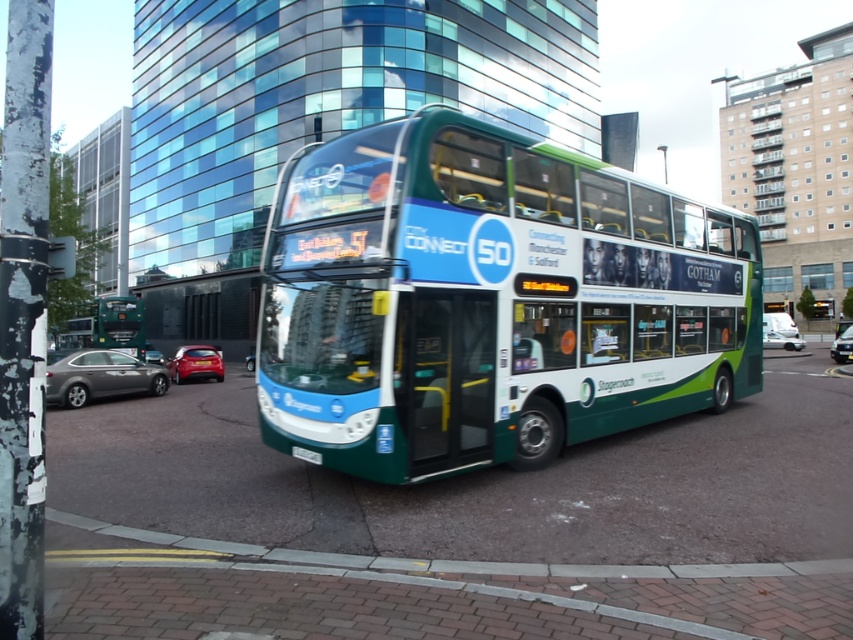
Question: Can you confirm if green matte/decorative double-decker bus at center is bigger than metallic silver car at center?

Choices:
 (A) no
 (B) yes

Answer: (B)

Question: Is metallic red hatchback at lower left above white glossy car at center?

Choices:
 (A) no
 (B) yes

Answer: (A)

Question: Which object is the closest to the white glossy car at center?

Choices:
 (A) metallic red hatchback at lower left
 (B) metallic silver car at center

Answer: (B)

Question: Which point is closer to the camera taking this photo?

Choices:
 (A) (115, 365)
 (B) (177, 376)
 (C) (300, 456)

Answer: (C)

Question: Which point is closer to the camera taking this photo?

Choices:
 (A) (113, 384)
 (B) (292, 449)
 (C) (840, 333)

Answer: (B)

Question: Does green matte/decorative double-decker bus at center appear over metallic silver car at center?

Choices:
 (A) yes
 (B) no

Answer: (A)